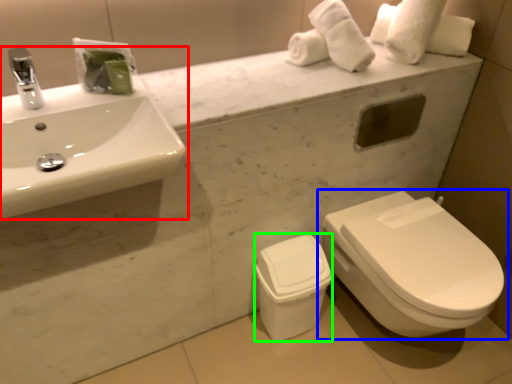
Question: Which object is the farthest from sink (highlighted by a red box)? Choose among these: toilet (highlighted by a blue box) or porcelain (highlighted by a green box).

Choices:
 (A) toilet
 (B) porcelain

Answer: (A)